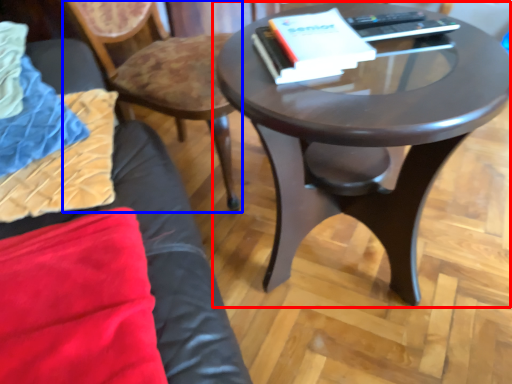
Question: Among these objects, which one is nearest to the camera, coffee table (highlighted by a red box) or chair (highlighted by a blue box)?

Choices:
 (A) coffee table
 (B) chair

Answer: (A)